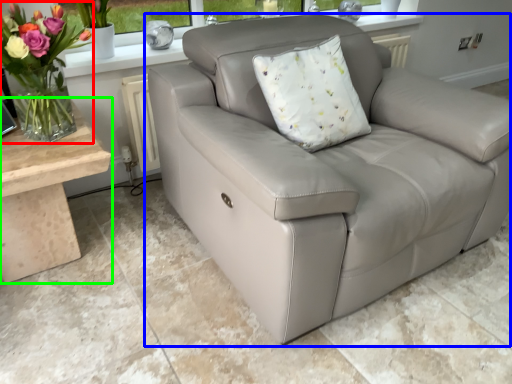
Question: Which is nearer to the floral arrangement (highlighted by a red box)? studio couch (highlighted by a blue box) or table (highlighted by a green box).

Choices:
 (A) studio couch
 (B) table

Answer: (B)